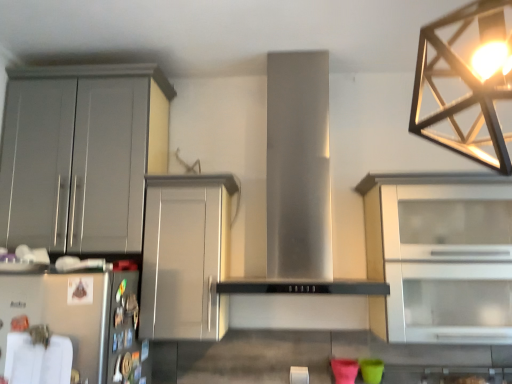
Question: Does satin silver cabinet at center, which ranks as the 2th cabinetry in right-to-left order, appear on the left side of matte gray cabinet at left, the first cabinetry in the left-to-right sequence?

Choices:
 (A) yes
 (B) no

Answer: (B)

Question: Is satin silver cabinet at center, the second cabinetry when ordered from left to right, to the right of matte gray cabinet at left, placed as the 3th cabinetry when sorted from right to left, from the viewer's perspective?

Choices:
 (A) no
 (B) yes

Answer: (B)

Question: From a real-world perspective, is satin silver cabinet at center, the second cabinetry when ordered from left to right, below matte gray cabinet at left, the first cabinetry in the left-to-right sequence?

Choices:
 (A) no
 (B) yes

Answer: (B)

Question: Is satin silver cabinet at center, which ranks as the 2th cabinetry in right-to-left order, not inside matte gray cabinet at left, the first cabinetry in the left-to-right sequence?

Choices:
 (A) no
 (B) yes

Answer: (B)

Question: Is matte gray cabinet at left, placed as the 3th cabinetry when sorted from right to left, a part of satin silver cabinet at center, which ranks as the 2th cabinetry in right-to-left order?

Choices:
 (A) yes
 (B) no

Answer: (B)

Question: In the image, is metallic geometric light fixture at upper right positioned in front of or behind matte gray cabinet at left, placed as the 3th cabinetry when sorted from right to left?

Choices:
 (A) behind
 (B) front

Answer: (B)

Question: Is metallic geometric light fixture at upper right spatially inside matte gray cabinet at left, the first cabinetry in the left-to-right sequence, or outside of it?

Choices:
 (A) inside
 (B) outside

Answer: (B)

Question: Is metallic geometric light fixture at upper right bigger or smaller than matte gray cabinet at left, the first cabinetry in the left-to-right sequence?

Choices:
 (A) small
 (B) big

Answer: (A)

Question: Is metallic geometric light fixture at upper right to the left or to the right of matte gray cabinet at left, placed as the 3th cabinetry when sorted from right to left, in the image?

Choices:
 (A) right
 (B) left

Answer: (A)

Question: From a real-world perspective, is white glass cabinet at right, which is the 3th cabinetry in left-to-right order, above or below matte gray cabinet at left, placed as the 3th cabinetry when sorted from right to left?

Choices:
 (A) above
 (B) below

Answer: (B)

Question: Considering the relative positions of white glass cabinet at right, which is the first cabinetry in right-to-left order, and matte gray cabinet at left, the first cabinetry in the left-to-right sequence, in the image provided, is white glass cabinet at right, which is the first cabinetry in right-to-left order, to the left or to the right of matte gray cabinet at left, the first cabinetry in the left-to-right sequence,?

Choices:
 (A) left
 (B) right

Answer: (B)

Question: In the image, is white glass cabinet at right, which is the 3th cabinetry in left-to-right order, positioned in front of or behind matte gray cabinet at left, placed as the 3th cabinetry when sorted from right to left?

Choices:
 (A) front
 (B) behind

Answer: (A)

Question: Is white glass cabinet at right, which is the 3th cabinetry in left-to-right order, inside the boundaries of matte gray cabinet at left, placed as the 3th cabinetry when sorted from right to left, or outside?

Choices:
 (A) inside
 (B) outside

Answer: (B)

Question: Which is correct: satin silver cabinet at center, the second cabinetry when ordered from left to right, is inside white glass cabinet at right, which is the first cabinetry in right-to-left order, or outside of it?

Choices:
 (A) inside
 (B) outside

Answer: (B)

Question: From the image's perspective, is satin silver cabinet at center, the second cabinetry when ordered from left to right, located above or below white glass cabinet at right, which is the first cabinetry in right-to-left order?

Choices:
 (A) above
 (B) below

Answer: (B)